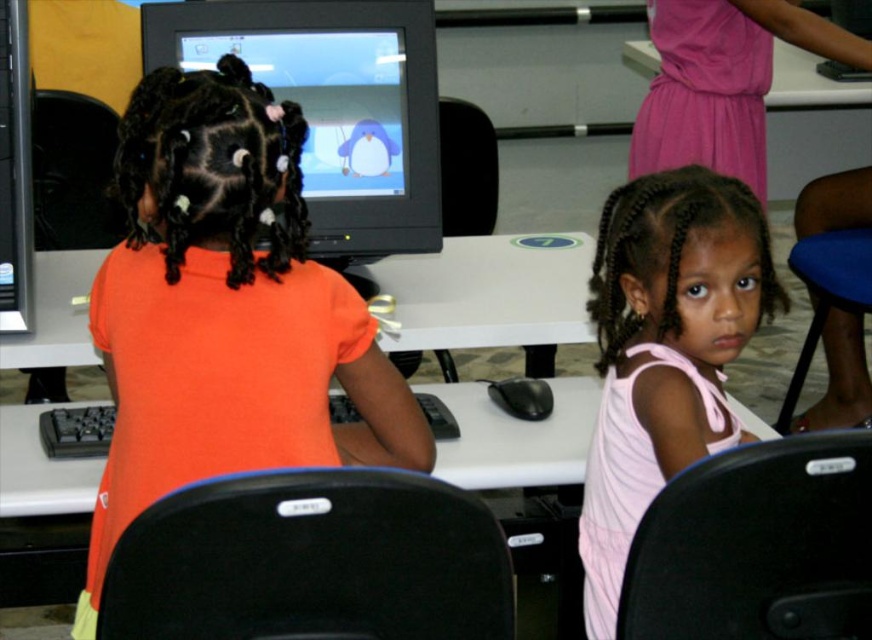
You are standing in the classroom and want to locate the orange matte shirt at center. According to the coordinates provided, can you estimate where it is positioned relative to the image frame?

The orange matte shirt at center is located at coordinates approximately 48.7 percent from the left edge and 25.9 percent from the top edge of the image frame.

You are a teacher observing the classroom. You notice the orange matte shirt at center and the matte black monitor at upper center. Which object takes up more space in the image?

The orange matte shirt at center is larger in size than the matte black monitor at upper center, so it takes up more space in the image.

Looking at this image, you are a teacher in the classroom. You notice the orange matte shirt at center and the white glossy table at upper center. Which object is closer to the floor?

The orange matte shirt at center is positioned under the white glossy table at upper center, meaning it is closer to the floor than the table.